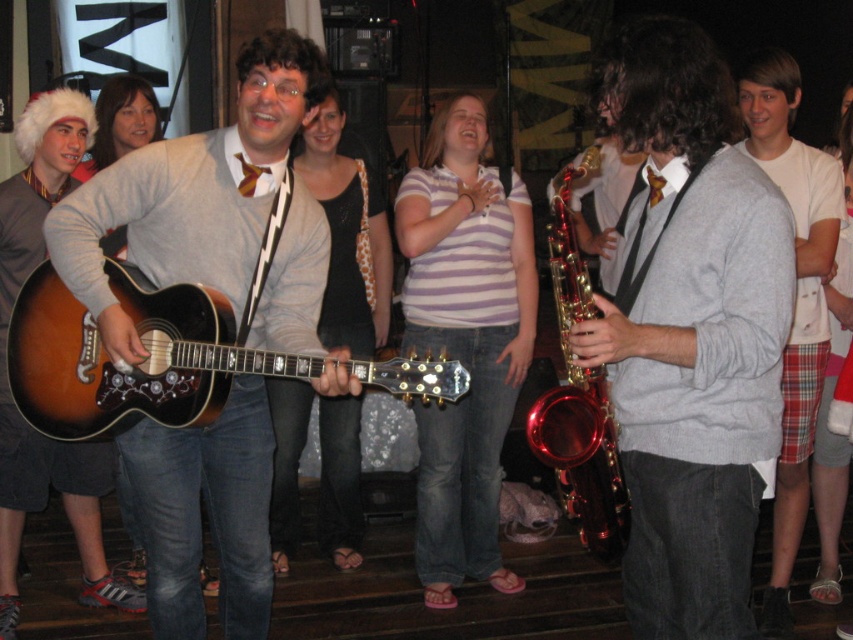
Question: Which of the following is the closest to the observer?

Choices:
 (A) metallic gold saxophone at center
 (B) matte black guitar at center

Answer: (A)

Question: Does matte brown guitar at left appear over metallic gold saxophone at center?

Choices:
 (A) yes
 (B) no

Answer: (B)

Question: Which object appears closest to the camera in this image?

Choices:
 (A) matte gray sweater at center
 (B) striped cotton shirt at center
 (C) white cotton t-shirt at right

Answer: (A)

Question: Among these points, which one is farthest from the camera?

Choices:
 (A) (231, 592)
 (B) (474, 144)
 (C) (677, 472)
 (D) (809, 288)

Answer: (B)

Question: Does striped cotton shirt at center appear under white cotton t-shirt at right?

Choices:
 (A) no
 (B) yes

Answer: (B)

Question: Does striped cotton shirt at center have a greater width compared to white cotton t-shirt at right?

Choices:
 (A) yes
 (B) no

Answer: (A)